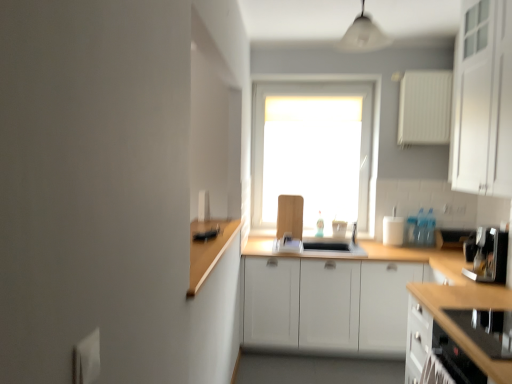
Find the location of `black glass stovetop at lower right, the 2th cabinetry when ordered from top to bottom`. black glass stovetop at lower right, the 2th cabinetry when ordered from top to bottom is located at coordinates (467, 308).

The width and height of the screenshot is (512, 384). What do you see at coordinates (467, 308) in the screenshot? I see `black glass stovetop at lower right, the 2th cabinetry when ordered from top to bottom` at bounding box center [467, 308].

Describe the element at coordinates (484, 331) in the screenshot. The image size is (512, 384). I see `black glass stove at lower right, which is the 2th appliance from left to right` at that location.

This screenshot has height=384, width=512. Describe the element at coordinates (362, 35) in the screenshot. I see `white glossy light fixture at upper center` at that location.

Where is `white matte window at center`? This screenshot has height=384, width=512. white matte window at center is located at coordinates (344, 86).

Identify the location of white textured radiator at upper right, which is the 1th appliance from right to left. (425, 107).

The height and width of the screenshot is (384, 512). What do you see at coordinates (425, 107) in the screenshot?
I see `white textured radiator at upper right, acting as the second appliance starting from the front` at bounding box center [425, 107].

At what (x,y) coordinates should I click in order to perform the action: click on black glass stovetop at lower right, the 2th cabinetry when ordered from top to bottom. Please return your answer as a coordinate pair (x, y). Looking at the image, I should click on (467, 308).

Locate an element on the screen. The width and height of the screenshot is (512, 384). coffee machine on the right of white glossy light fixture at upper center is located at coordinates (487, 255).

Between white glossy light fixture at upper center and sleek metallic coffee machine at right, which one appears on the left side from the viewer's perspective?

Positioned to the left is white glossy light fixture at upper center.

From a real-world perspective, which is physically below, white glossy light fixture at upper center or sleek metallic coffee machine at right?

sleek metallic coffee machine at right, from a real-world perspective.

Is white glossy light fixture at upper center positioned with its back to sleek metallic coffee machine at right?

No, white glossy light fixture at upper center's orientation is not away from sleek metallic coffee machine at right.

Does point (418, 97) appear closer or farther from the camera than point (246, 262)?

Point (418, 97) appears to be farther away from the viewer than point (246, 262).

Can you confirm if white textured radiator at upper right, the fourth appliance positioned from the left, is thinner than wooden at center?

Indeed, white textured radiator at upper right, the fourth appliance positioned from the left, has a lesser width compared to wooden at center.

How many degrees apart are the facing directions of white textured radiator at upper right, the third appliance positioned from the back, and wooden at center?

The angle between the facing direction of white textured radiator at upper right, the third appliance positioned from the back, and the facing direction of wooden at center is 1.69 degrees.

Does white textured radiator at upper right, which is the 1th appliance from right to left, appear on the right side of wooden at center?

Indeed, white textured radiator at upper right, which is the 1th appliance from right to left, is positioned on the right side of wooden at center.

Can you tell me how much white glossy light fixture at upper center and black glass stove at lower right, which is the 2th appliance from left to right, differ in facing direction?

90 degrees separate the facing orientations of white glossy light fixture at upper center and black glass stove at lower right, which is the 2th appliance from left to right.

Looking at this image, from the image's perspective, is white glossy light fixture at upper center beneath black glass stove at lower right, which appears as the fourth appliance when viewed from the top?

Incorrect, from the image's perspective, white glossy light fixture at upper center is higher than black glass stove at lower right, which appears as the fourth appliance when viewed from the top.

Looking at this image, is white glossy light fixture at upper center wider than black glass stove at lower right, the 1th appliance positioned from the bottom?

In fact, white glossy light fixture at upper center might be narrower than black glass stove at lower right, the 1th appliance positioned from the bottom.

Considering the relative sizes of white glossy light fixture at upper center and black glass stove at lower right, the 1th appliance positioned from the bottom, in the image provided, is white glossy light fixture at upper center bigger than black glass stove at lower right, the 1th appliance positioned from the bottom,?

Yes.

From the image's perspective, which object appears higher, black glass stovetop at lower right, the 2th cabinetry when ordered from top to bottom, or wooden cutting board at center, the first appliance positioned from the left?

wooden cutting board at center, the first appliance positioned from the left, from the image's perspective.

Is black glass stovetop at lower right, marked as the first cabinetry in a bottom-to-top arrangement, situated inside wooden cutting board at center, which is counted as the 1th appliance, starting from the back, or outside?

black glass stovetop at lower right, marked as the first cabinetry in a bottom-to-top arrangement, cannot be found inside wooden cutting board at center, which is counted as the 1th appliance, starting from the back.

Does point (480, 288) come behind point (298, 229)?

No, it is in front of (298, 229).

Is black glass stovetop at lower right, the 2th cabinetry when ordered from top to bottom, positioned with its back to wooden cutting board at center, the first appliance positioned from the left?

No, black glass stovetop at lower right, the 2th cabinetry when ordered from top to bottom, is not facing the opposite direction of wooden cutting board at center, the first appliance positioned from the left.

Which object is positioned more to the left, black glass stovetop at lower right, marked as the first cabinetry in a bottom-to-top arrangement, or white matte window at center?

white matte window at center.

In the image, is black glass stovetop at lower right, marked as the first cabinetry in a bottom-to-top arrangement, positioned in front of or behind white matte window at center?

Clearly, black glass stovetop at lower right, marked as the first cabinetry in a bottom-to-top arrangement, is in front of white matte window at center.

Can you confirm if black glass stovetop at lower right, the 2th cabinetry when ordered from top to bottom, is wider than white matte window at center?

Indeed, black glass stovetop at lower right, the 2th cabinetry when ordered from top to bottom, has a greater width compared to white matte window at center.

From the picture: Is black glass stovetop at lower right, the 2th cabinetry when ordered from top to bottom, taller or shorter than white matte window at center?

Clearly, black glass stovetop at lower right, the 2th cabinetry when ordered from top to bottom, is shorter compared to white matte window at center.

How different are the orientations of black glass stovetop at lower right, the 2th cabinetry when ordered from top to bottom, and sleek metallic coffee machine at right in degrees?

The angle between the facing direction of black glass stovetop at lower right, the 2th cabinetry when ordered from top to bottom, and the facing direction of sleek metallic coffee machine at right is 0.257 degrees.

Where is `cabinetry that appears below the sleek metallic coffee machine at right (from a real-world perspective)`? cabinetry that appears below the sleek metallic coffee machine at right (from a real-world perspective) is located at coordinates (467, 308).

Which of these two, black glass stovetop at lower right, marked as the first cabinetry in a bottom-to-top arrangement, or sleek metallic coffee machine at right, is smaller?

sleek metallic coffee machine at right is smaller.

Is white textured radiator at upper right, acting as the second appliance starting from the front, oriented towards wooden cutting board at center, which ranks as the 3th appliance in bottom-to-top order?

No.

Who is shorter, white textured radiator at upper right, the third appliance positioned from the back, or wooden cutting board at center, the 4th appliance from the right?

Standing shorter between the two is wooden cutting board at center, the 4th appliance from the right.

From a real-world perspective, is white textured radiator at upper right, which is the 1th appliance from right to left, above or below wooden cutting board at center, the first appliance positioned from the left?

From a real-world perspective, white textured radiator at upper right, which is the 1th appliance from right to left, is physically above wooden cutting board at center, the first appliance positioned from the left.

In the scene shown: From the image's perspective, is white textured radiator at upper right, the third appliance positioned from the back, below wooden cutting board at center, the 4th appliance from the right?

No.

Identify the location of coffee machine below the white glossy light fixture at upper center (from a real-world perspective). Image resolution: width=512 pixels, height=384 pixels. (487, 255).

The width and height of the screenshot is (512, 384). I want to click on the 4th appliance above the wooden at center (from the image's perspective), so point(425,107).

Based on their spatial positions, is white matte window at center or wooden at center further from wooden cutting board at center, the first appliance positioned from the left?

The object further to wooden cutting board at center, the first appliance positioned from the left, is white matte window at center.

Which object lies nearer to the anchor point white plastic container at right, acting as the 3th appliance starting from the front, white glossy light fixture at upper center or white matte cabinet at upper right, which ranks as the first cabinetry in top-to-bottom order?

white glossy light fixture at upper center is closer to white plastic container at right, acting as the 3th appliance starting from the front.

When comparing their distances from wooden at center, does black glass stove at lower right, the 1th appliance positioned from the bottom, or white plastic container at right, which appears as the second appliance when viewed from the right, seem closer?

black glass stove at lower right, the 1th appliance positioned from the bottom, is positioned closer to the anchor wooden at center.

When comparing their distances from sleek metallic coffee machine at right, does black glass stove at lower right, which is the 2th appliance from left to right, or white matte window at center seem further?

Based on the image, white matte window at center appears to be further to sleek metallic coffee machine at right.

Based on the photo, estimate the real-world distances between objects in this image. Which object is closer to wooden cutting board at center, the 4th appliance from the right, black glass stovetop at lower right, the 2th cabinetry when ordered from top to bottom, or sleek metallic coffee machine at right?

sleek metallic coffee machine at right lies closer to wooden cutting board at center, the 4th appliance from the right, than the other object.

Based on their spatial positions, is white textured radiator at upper right, the fourth appliance positioned from the left, or sleek metallic coffee machine at right further from wooden cutting board at center, which is counted as the 1th appliance, starting from the back?

sleek metallic coffee machine at right is further to wooden cutting board at center, which is counted as the 1th appliance, starting from the back.

Based on their spatial positions, is sleek metallic coffee machine at right or wooden at center further from white plastic container at right, which appears as the second appliance when viewed from the right?

sleek metallic coffee machine at right is positioned further to the anchor white plastic container at right, which appears as the second appliance when viewed from the right.

Looking at the image, which one is located further to white plastic container at right, placed as the 3th appliance when sorted from top to bottom, white matte cabinet at upper right, acting as the 2th cabinetry starting from the bottom, or wooden cutting board at center, placed as the second appliance when sorted from top to bottom?

The object further to white plastic container at right, placed as the 3th appliance when sorted from top to bottom, is white matte cabinet at upper right, acting as the 2th cabinetry starting from the bottom.

Where is `coffee machine positioned between black glass stovetop at lower right, marked as the first cabinetry in a bottom-to-top arrangement, and white plastic container at right, positioned as the 2th appliance in back-to-front order, from near to far`? coffee machine positioned between black glass stovetop at lower right, marked as the first cabinetry in a bottom-to-top arrangement, and white plastic container at right, positioned as the 2th appliance in back-to-front order, from near to far is located at coordinates (487, 255).

Where is `cabinetry located between black glass stovetop at lower right, the 2th cabinetry when ordered from top to bottom, and white textured radiator at upper right, which is the 1th appliance from right to left, in the depth direction`? cabinetry located between black glass stovetop at lower right, the 2th cabinetry when ordered from top to bottom, and white textured radiator at upper right, which is the 1th appliance from right to left, in the depth direction is located at coordinates (483, 99).

Where is `appliance located between black glass stove at lower right, which appears as the fourth appliance when viewed from the top, and white plastic container at right, which is the 2th appliance in bottom-to-top order, in the depth direction`? appliance located between black glass stove at lower right, which appears as the fourth appliance when viewed from the top, and white plastic container at right, which is the 2th appliance in bottom-to-top order, in the depth direction is located at coordinates (425, 107).

I want to click on appliance positioned between sleek metallic coffee machine at right and white plastic container at right, acting as the 3th appliance starting from the front, from near to far, so click(x=425, y=107).